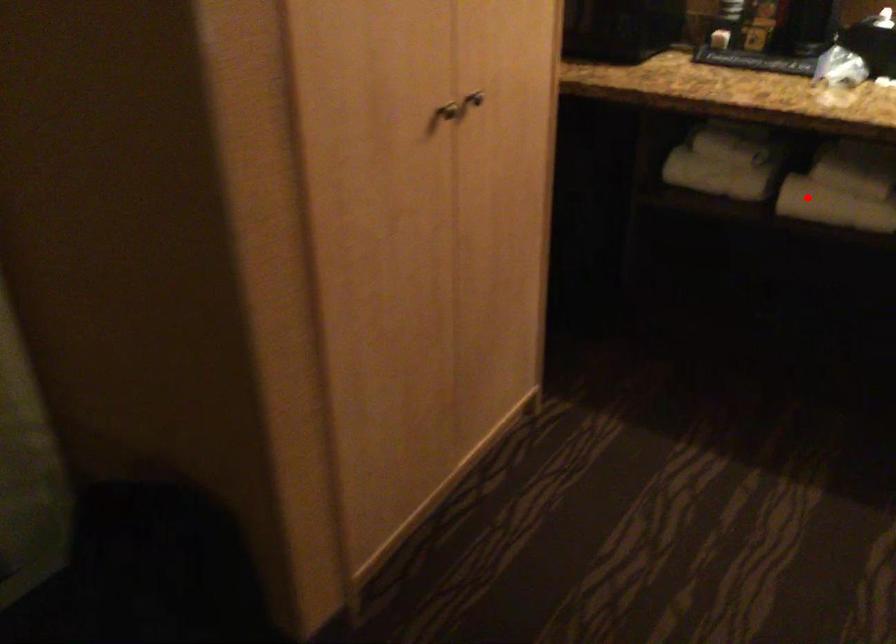
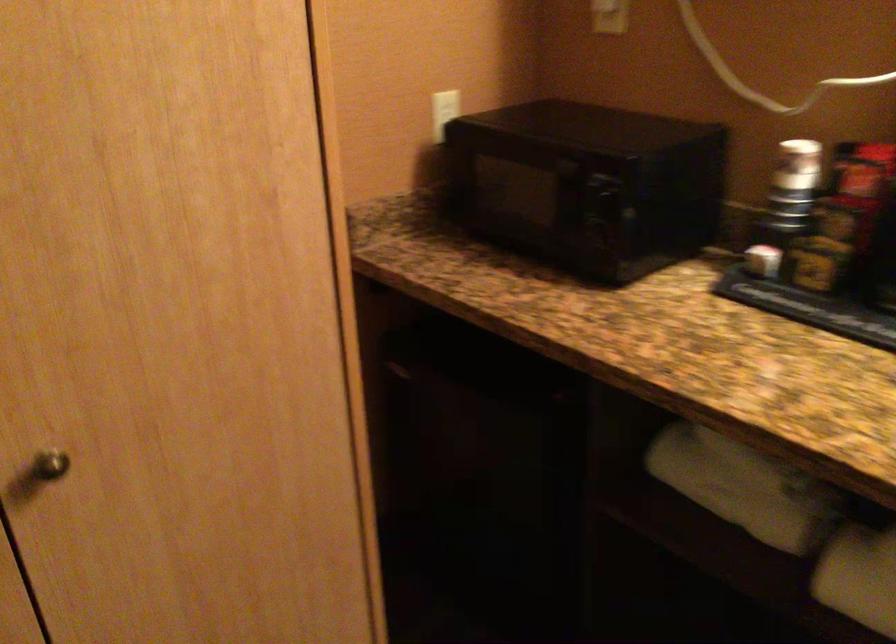
In the second image, find the point that corresponds to the highlighted location in the first image.

(858, 576)